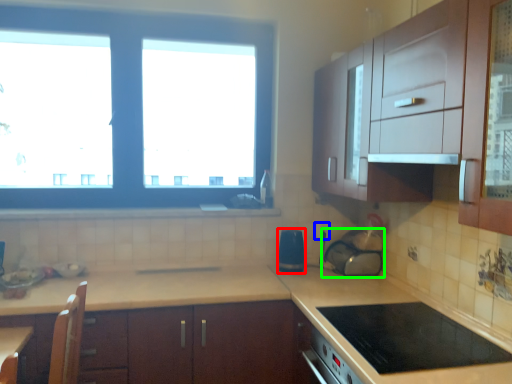
Question: Which object is positioned closest to appliance (highlighted by a red box)? Select from electric outlet (highlighted by a blue box) and appliance (highlighted by a green box).

Choices:
 (A) electric outlet
 (B) appliance

Answer: (A)